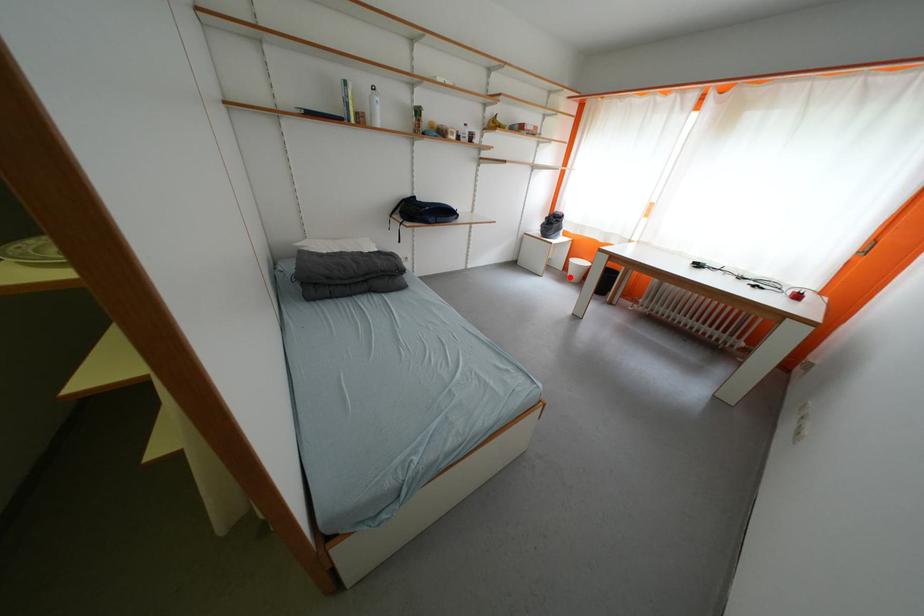
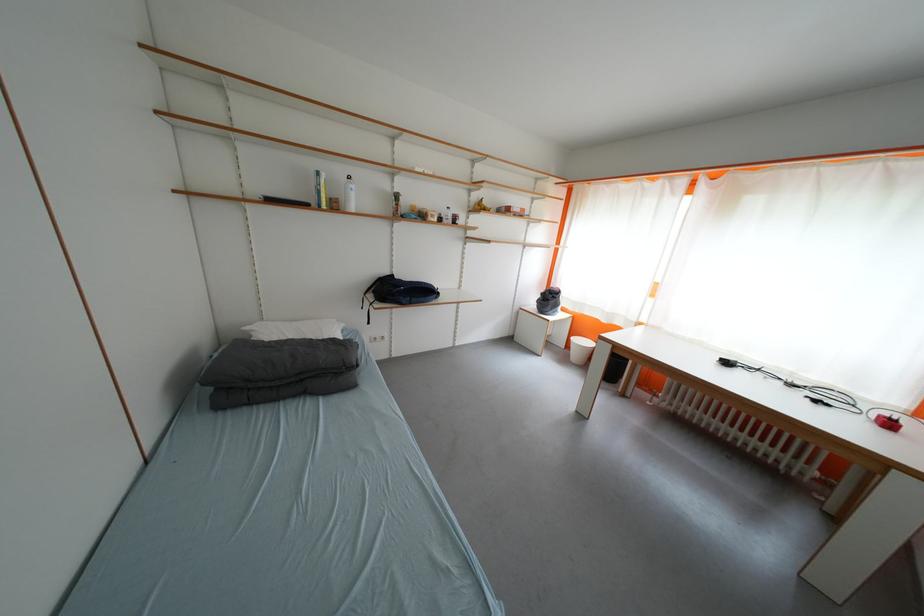
Question: A red point is marked in image1. In image2, is the corresponding 3D point closer to the camera or farther? Reply with the corresponding letter.

Choices:
 (A) The corresponding 3D point is closer.
 (B) The corresponding 3D point is farther.

Answer: (A)